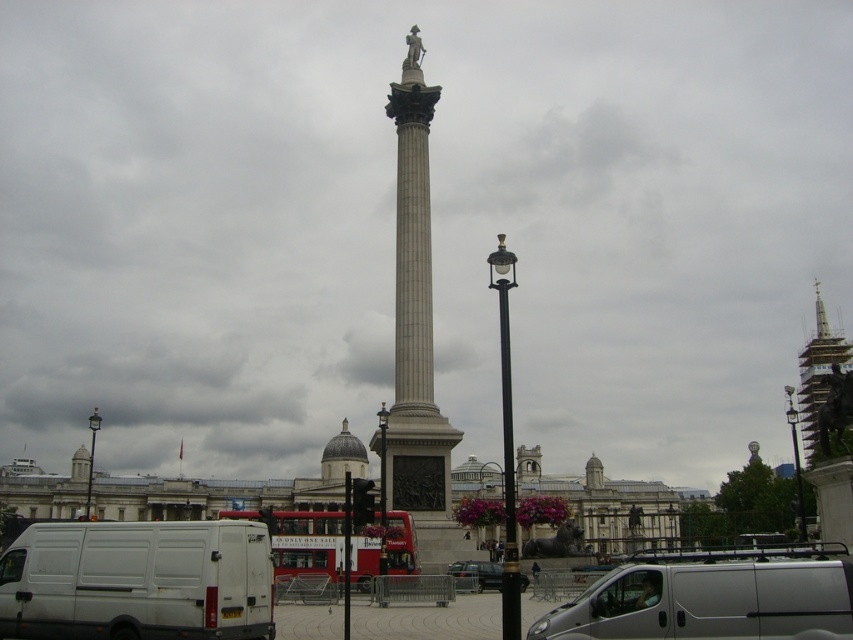
Is point (503, 435) positioned before point (488, 577)?

No, it is behind (488, 577).

Is point (503, 387) positioned before point (479, 573)?

Yes, point (503, 387) is in front of point (479, 573).

At what (x,y) coordinates should I click in order to perform the action: click on black metal lamp post at center. Please return your answer as a coordinate pair (x, y). The image size is (853, 640). Looking at the image, I should click on (506, 445).

Is silver metallic van at center wider than black polished lamp post at center?

Indeed, silver metallic van at center has a greater width compared to black polished lamp post at center.

Image resolution: width=853 pixels, height=640 pixels. In order to click on silver metallic van at center in this screenshot , I will do `click(711, 598)`.

Is white matte van at lower left wider than black metal lamp post at center?

No, white matte van at lower left is not wider than black metal lamp post at center.

Is white matte van at lower left thinner than black metal lamp post at center?

Indeed, white matte van at lower left has a lesser width compared to black metal lamp post at center.

Locate an element on the screen. This screenshot has height=640, width=853. white matte van at lower left is located at coordinates (138, 580).